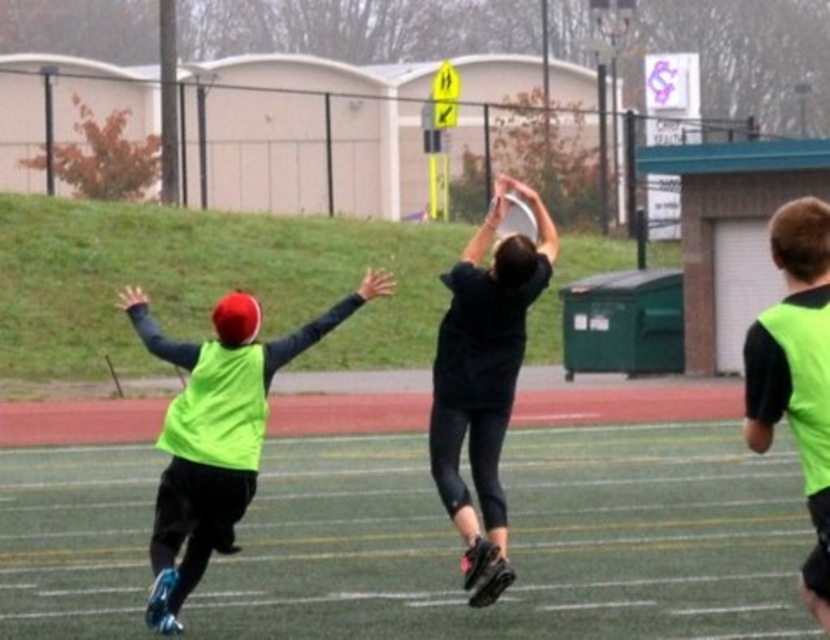
Is point (264, 387) closer to viewer compared to point (443, 397)?

Yes, point (264, 387) is closer to viewer.

Is neon green vest at center bigger than black matte jersey at center?

Yes, neon green vest at center is bigger than black matte jersey at center.

Describe the element at coordinates (216, 432) in the screenshot. The width and height of the screenshot is (830, 640). I see `neon green vest at center` at that location.

You are a GUI agent. You are given a task and a screenshot of the screen. Output one action in this format:
    pyautogui.click(x=<x>, y=<y>)
    Task: Click on the neon green vest at center
    
    Given the screenshot: What is the action you would take?
    pyautogui.click(x=216, y=432)

Looking at this image, which of these two, green synthetic turf at center or neon green vest at right, stands shorter?

green synthetic turf at center

Between green synthetic turf at center and neon green vest at right, which one appears on the right side from the viewer's perspective?

Positioned to the right is neon green vest at right.

The height and width of the screenshot is (640, 830). What do you see at coordinates (521, 540) in the screenshot?
I see `green synthetic turf at center` at bounding box center [521, 540].

This screenshot has width=830, height=640. In order to click on green synthetic turf at center in this screenshot , I will do `click(521, 540)`.

Between green synthetic turf at center and neon green vest at center, which one has more height?

neon green vest at center

Between point (354, 609) and point (252, 486), which one is positioned in front?

Point (252, 486) is in front.

The width and height of the screenshot is (830, 640). What are the coordinates of `green synthetic turf at center` in the screenshot? It's located at (521, 540).